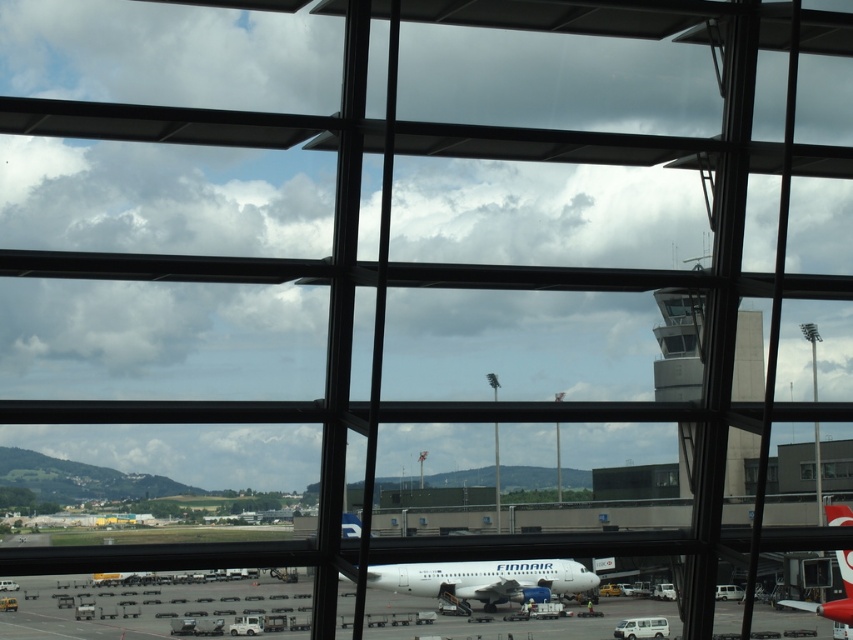
You are a passenger sitting in the airport terminal and looking out through the transparent glass window at center. You notice the white glossy airplane at lower right. Based on your current position, is the airplane located directly below the window or to the side of it?

The white glossy airplane at lower right is positioned under the transparent glass window at center, so it is directly below the window.

You are a passenger sitting in the airport terminal and looking out through the transparent glass window at center. You see the white glossy airplane at lower right outside. Can you determine if the airplane is positioned to the left or right of the window from your perspective?

The white glossy airplane at lower right is to the right of the transparent glass window at center, so from your perspective looking out the window, the airplane is positioned to the right of the window.

You are standing at the airport terminal looking out through the large glass windows. You notice a point marked at coordinates (136, 605). What object does this point correspond to?

The point at coordinates (136, 605) corresponds to the white glossy airplane at center.